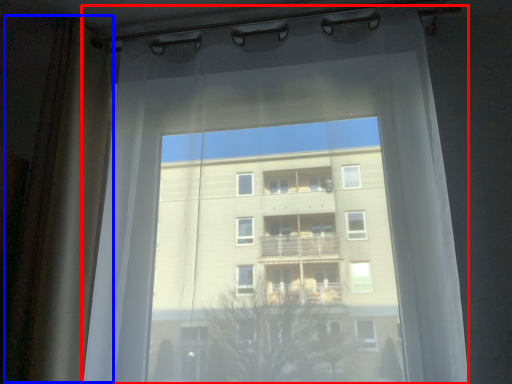
Question: Which object appears closest to the camera in this image, curtain (highlighted by a red box) or shower curtain (highlighted by a blue box)?

Choices:
 (A) curtain
 (B) shower curtain

Answer: (A)